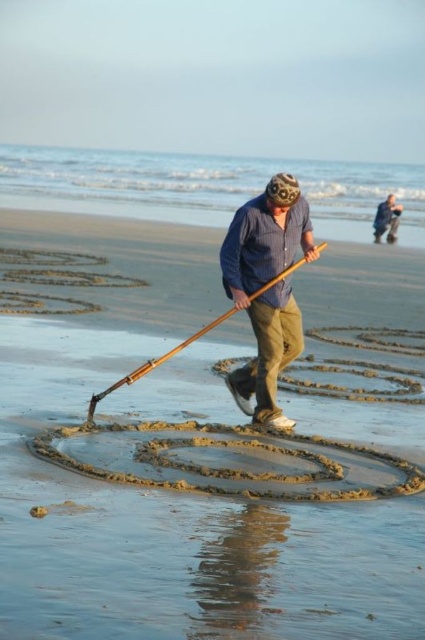
Question: Which object is the closest to the sandy beach at center?

Choices:
 (A) blue striped shirt at center
 (B) blue striped shirt at upper center

Answer: (A)

Question: Which point is farther from the camera taking this photo?

Choices:
 (A) (394, 218)
 (B) (257, 560)
 (C) (243, 403)

Answer: (A)

Question: Does blue striped shirt at center appear under blue striped shirt at upper center?

Choices:
 (A) no
 (B) yes

Answer: (B)

Question: Which of the following is the closest to the observer?

Choices:
 (A) (390, 230)
 (B) (280, 326)

Answer: (B)

Question: Is blue striped shirt at center wider than blue striped shirt at upper center?

Choices:
 (A) no
 (B) yes

Answer: (A)

Question: Is blue striped shirt at center below blue striped shirt at upper center?

Choices:
 (A) no
 (B) yes

Answer: (B)